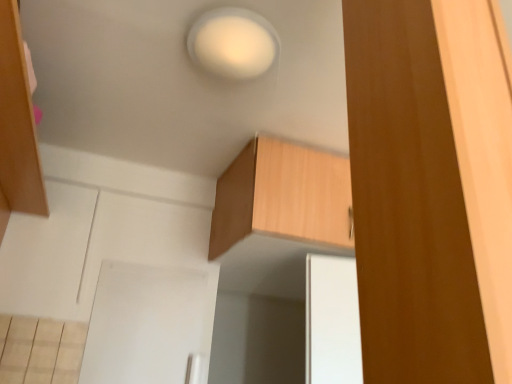
Question: From the image's perspective, would you say wooden cabinet at upper center, which is counted as the first cabinetry, starting from the back, is positioned over brown wood cabinet at right, the 1th cabinetry from the front?

Choices:
 (A) yes
 (B) no

Answer: (B)

Question: Does wooden cabinet at upper center, which is counted as the first cabinetry, starting from the back, appear on the right side of brown wood cabinet at right, which is the 2th cabinetry in back-to-front order?

Choices:
 (A) no
 (B) yes

Answer: (A)

Question: Does wooden cabinet at upper center, which appears as the second cabinetry when viewed from the front, have a greater height compared to brown wood cabinet at right, which is the 2th cabinetry in back-to-front order?

Choices:
 (A) no
 (B) yes

Answer: (A)

Question: Does wooden cabinet at upper center, which is counted as the first cabinetry, starting from the back, appear on the left side of brown wood cabinet at right, the 1th cabinetry from the front?

Choices:
 (A) yes
 (B) no

Answer: (A)

Question: From a real-world perspective, is wooden cabinet at upper center, which appears as the second cabinetry when viewed from the front, physically above brown wood cabinet at right, the 1th cabinetry from the front?

Choices:
 (A) yes
 (B) no

Answer: (A)

Question: From a real-world perspective, is white matte light at upper center physically located above or below wooden cabinet at upper center, which appears as the second cabinetry when viewed from the front?

Choices:
 (A) below
 (B) above

Answer: (B)

Question: From the image's perspective, is white matte light at upper center located above or below wooden cabinet at upper center, which is counted as the first cabinetry, starting from the back?

Choices:
 (A) above
 (B) below

Answer: (A)

Question: Considering the positions of point (225, 34) and point (262, 175), is point (225, 34) closer or farther from the camera than point (262, 175)?

Choices:
 (A) closer
 (B) farther

Answer: (A)

Question: Is white matte light at upper center wider or thinner than wooden cabinet at upper center, which appears as the second cabinetry when viewed from the front?

Choices:
 (A) wide
 (B) thin

Answer: (B)

Question: Is wooden cabinet at upper center, which appears as the second cabinetry when viewed from the front, spatially inside white matte light at upper center, or outside of it?

Choices:
 (A) inside
 (B) outside

Answer: (B)

Question: From the image's perspective, is wooden cabinet at upper center, which is counted as the first cabinetry, starting from the back, positioned above or below white matte light at upper center?

Choices:
 (A) below
 (B) above

Answer: (A)

Question: From their relative heights in the image, would you say wooden cabinet at upper center, which appears as the second cabinetry when viewed from the front, is taller or shorter than white matte light at upper center?

Choices:
 (A) short
 (B) tall

Answer: (B)

Question: In terms of width, does wooden cabinet at upper center, which is counted as the first cabinetry, starting from the back, look wider or thinner when compared to white matte light at upper center?

Choices:
 (A) thin
 (B) wide

Answer: (B)

Question: Considering the positions of white matte light at upper center and brown wood cabinet at right, which is the 2th cabinetry in back-to-front order, in the image, is white matte light at upper center taller or shorter than brown wood cabinet at right, which is the 2th cabinetry in back-to-front order,?

Choices:
 (A) tall
 (B) short

Answer: (B)

Question: In terms of size, does white matte light at upper center appear bigger or smaller than brown wood cabinet at right, the 1th cabinetry from the front?

Choices:
 (A) small
 (B) big

Answer: (A)